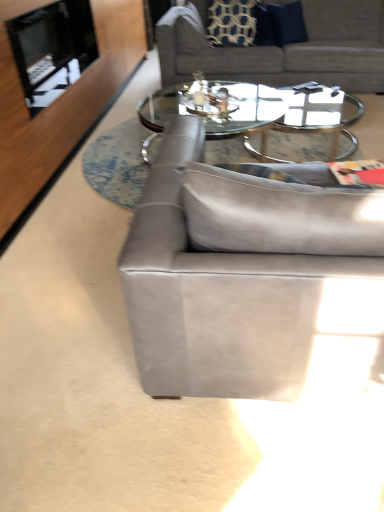
Question: Is black glass fireplace at upper left a part of clear glass coffee table at center?

Choices:
 (A) no
 (B) yes

Answer: (A)

Question: Considering the relative sizes of clear glass coffee table at center and black glass fireplace at upper left in the image provided, is clear glass coffee table at center smaller than black glass fireplace at upper left?

Choices:
 (A) yes
 (B) no

Answer: (B)

Question: Is clear glass coffee table at center positioned far away from black glass fireplace at upper left?

Choices:
 (A) yes
 (B) no

Answer: (A)

Question: Is clear glass coffee table at center to the left of black glass fireplace at upper left from the viewer's perspective?

Choices:
 (A) yes
 (B) no

Answer: (B)

Question: Is clear glass coffee table at center oriented away from black glass fireplace at upper left?

Choices:
 (A) no
 (B) yes

Answer: (A)

Question: From the image's perspective, would you say clear glass coffee table at center is positioned over black glass fireplace at upper left?

Choices:
 (A) yes
 (B) no

Answer: (B)

Question: Is suede gray couch at center, which is the 2th studio couch from back to front, positioned with its back to black glass fireplace at upper left?

Choices:
 (A) no
 (B) yes

Answer: (A)

Question: From the image's perspective, would you say suede gray couch at center, the 1th studio couch viewed from the front, is shown under black glass fireplace at upper left?

Choices:
 (A) yes
 (B) no

Answer: (A)

Question: Does suede gray couch at center, the 1th studio couch viewed from the front, appear on the right side of black glass fireplace at upper left?

Choices:
 (A) no
 (B) yes

Answer: (B)

Question: Is suede gray couch at center, the 1th studio couch viewed from the front, next to black glass fireplace at upper left and touching it?

Choices:
 (A) yes
 (B) no

Answer: (B)

Question: From a real-world perspective, is suede gray couch at center, the 1th studio couch viewed from the front, beneath black glass fireplace at upper left?

Choices:
 (A) no
 (B) yes

Answer: (B)

Question: Considering the relative sizes of suede gray couch at center, the 1th studio couch viewed from the front, and black glass fireplace at upper left in the image provided, is suede gray couch at center, the 1th studio couch viewed from the front, taller than black glass fireplace at upper left?

Choices:
 (A) no
 (B) yes

Answer: (B)

Question: Is suede gray couch at upper center, arranged as the 2th studio couch when ordered from the bottom, bigger than suede gray couch at center, the 1th studio couch positioned from the bottom?

Choices:
 (A) yes
 (B) no

Answer: (A)